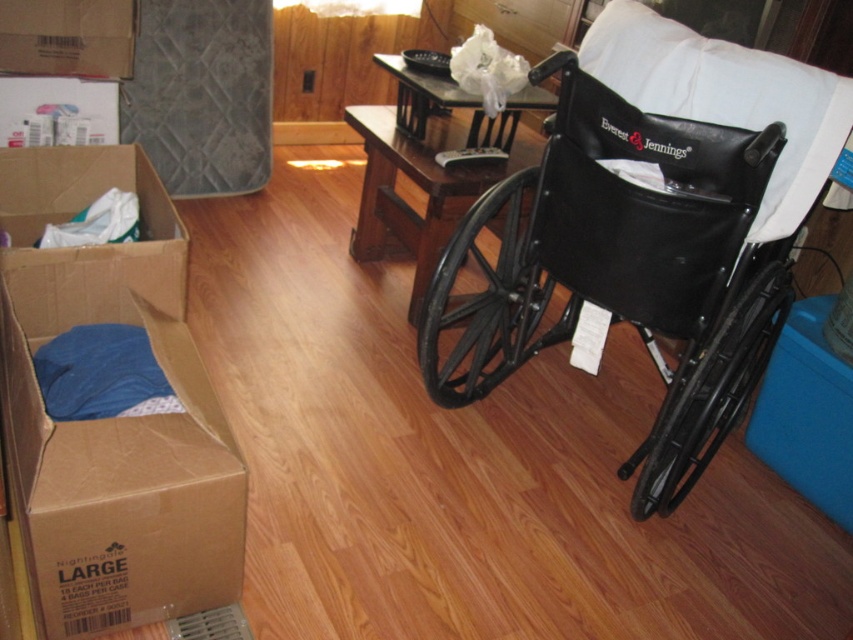
Question: Is dark gray quilted mattress at left closer to the viewer compared to brown cardboard box at upper left?

Choices:
 (A) no
 (B) yes

Answer: (A)

Question: Does black plastic wheelchair at right appear over brown cardboard box at upper left?

Choices:
 (A) yes
 (B) no

Answer: (B)

Question: Among these objects, which one is nearest to the camera?

Choices:
 (A) dark gray quilted mattress at left
 (B) brown cardboard box at upper left

Answer: (B)

Question: From the image, what is the correct spatial relationship of black plastic wheelchair at right in relation to brown cardboard box at upper left?

Choices:
 (A) right
 (B) left

Answer: (A)

Question: Estimate the real-world distances between objects in this image. Which object is farther from the dark gray quilted mattress at left?

Choices:
 (A) brown cardboard box at upper left
 (B) black plastic wheelchair at right

Answer: (B)

Question: Among these points, which one is nearest to the camera?

Choices:
 (A) (10, 6)
 (B) (769, 168)
 (C) (169, 45)

Answer: (B)